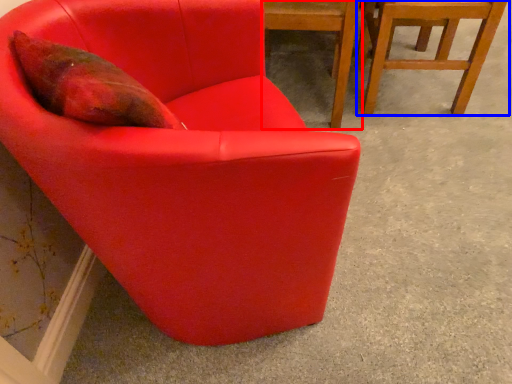
Question: Which point is closer to the camera, chair (highlighted by a red box) or chair (highlighted by a blue box)?

Choices:
 (A) chair
 (B) chair

Answer: (A)